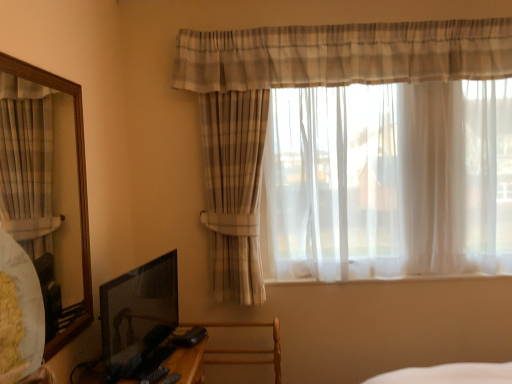
Locate an element on the screen. The image size is (512, 384). matte black tv at lower left is located at coordinates (136, 311).

The width and height of the screenshot is (512, 384). I want to click on swivel chair lying below the wooden mirror at left (from the image's perspective), so click(x=248, y=350).

Consider the image. Is wooden swivel chair at lower center to the right of wooden mirror at left from the viewer's perspective?

Yes.

Is wooden swivel chair at lower center wider or thinner than wooden mirror at left?

In the image, wooden swivel chair at lower center appears to be wider than wooden mirror at left.

Can you confirm if wooden mirror at left is positioned to the right of plaid sheer curtain at upper center?

Incorrect, wooden mirror at left is not on the right side of plaid sheer curtain at upper center.

Is wooden mirror at left spatially inside plaid sheer curtain at upper center, or outside of it?

wooden mirror at left cannot be found inside plaid sheer curtain at upper center.

In the scene shown: Is wooden mirror at left positioned before plaid sheer curtain at upper center?

Yes, it is in front of plaid sheer curtain at upper center.

Is wooden swivel chair at lower center positioned with its back to matte black tv at lower left?

No.

I want to click on picture frame above the wooden swivel chair at lower center (from a real-world perspective), so click(136, 311).

Which is in front, wooden swivel chair at lower center or matte black tv at lower left?

matte black tv at lower left is closer to the camera.

From a real-world perspective, is wooden swivel chair at lower center below matte black tv at lower left?

Indeed, from a real-world perspective, wooden swivel chair at lower center is positioned beneath matte black tv at lower left.

Looking at this image, considering the sizes of objects matte black tv at lower left and plaid sheer curtain at upper center in the image provided, who is bigger, matte black tv at lower left or plaid sheer curtain at upper center?

plaid sheer curtain at upper center is bigger.

Consider the image. Which point is more forward, (110, 301) or (231, 126)?

Positioned in front is point (110, 301).

Where is `curtain above the matte black tv at lower left (from the image's perspective)`? curtain above the matte black tv at lower left (from the image's perspective) is located at coordinates coord(330,66).

Could you tell me if plaid sheer curtain at upper center is facing wooden mirror at left?

Yes.

How many degrees apart are the facing directions of plaid sheer curtain at upper center and wooden mirror at left?

They differ by 89.8 degrees in their facing directions.

In the scene shown: Is plaid sheer curtain at upper center to the right of wooden mirror at left from the viewer's perspective?

Correct, you'll find plaid sheer curtain at upper center to the right of wooden mirror at left.

Would you say wooden mirror at left is part of plaid sheer curtain at upper center's contents?

No, wooden mirror at left is not surrounded by plaid sheer curtain at upper center.

Is matte black tv at lower left taller than wooden swivel chair at lower center?

Incorrect, the height of matte black tv at lower left is not larger of that of wooden swivel chair at lower center.

Considering their positions, is matte black tv at lower left located in front of or behind wooden swivel chair at lower center?

In the image, matte black tv at lower left appears in front of wooden swivel chair at lower center.

Based on their sizes in the image, would you say matte black tv at lower left is bigger or smaller than wooden swivel chair at lower center?

matte black tv at lower left is smaller than wooden swivel chair at lower center.

Is there a large distance between matte black tv at lower left and wooden swivel chair at lower center?

No.

Does matte black tv at lower left lie behind wooden mirror at left?

Yes, the depth of matte black tv at lower left is greater than that of wooden mirror at left.

Between point (173, 301) and point (58, 351), which one is positioned in front?

The point (58, 351) is in front.

Is matte black tv at lower left directly adjacent to wooden mirror at left?

No, matte black tv at lower left is not touching wooden mirror at left.

In the scene shown: Does matte black tv at lower left have a lesser width compared to wooden mirror at left?

In fact, matte black tv at lower left might be wider than wooden mirror at left.

Find the location of a particular element. swivel chair behind the wooden mirror at left is located at coordinates (248, 350).

Locate an element on the screen. The image size is (512, 384). curtain above the wooden mirror at left (from the image's perspective) is located at coordinates (330, 66).

Based on their spatial positions, is plaid sheer curtain at upper center or wooden mirror at left closer to matte black tv at lower left?

wooden mirror at left is closer to matte black tv at lower left.

Considering their positions, is matte black tv at lower left positioned closer to wooden swivel chair at lower center than plaid sheer curtain at upper center?

Among the two, matte black tv at lower left is located nearer to wooden swivel chair at lower center.

Based on their spatial positions, is wooden mirror at left or plaid sheer curtain at upper center further from matte black tv at lower left?

The object further to matte black tv at lower left is plaid sheer curtain at upper center.

From the image, which object appears to be nearer to wooden swivel chair at lower center, wooden mirror at left or plaid sheer curtain at upper center?

Among the two, plaid sheer curtain at upper center is located nearer to wooden swivel chair at lower center.

Considering their positions, is plaid sheer curtain at upper center positioned further to wooden swivel chair at lower center than matte black tv at lower left?

Among the two, plaid sheer curtain at upper center is located further to wooden swivel chair at lower center.

Which object lies nearer to the anchor point wooden mirror at left, plaid sheer curtain at upper center or wooden swivel chair at lower center?

Based on the image, wooden swivel chair at lower center appears to be nearer to wooden mirror at left.

Estimate the real-world distances between objects in this image. Which object is further from plaid sheer curtain at upper center, wooden mirror at left or wooden swivel chair at lower center?

Among the two, wooden mirror at left is located further to plaid sheer curtain at upper center.

From the image, which object appears to be nearer to matte black tv at lower left, wooden swivel chair at lower center or wooden mirror at left?

The object closer to matte black tv at lower left is wooden mirror at left.

At what (x,y) coordinates should I click in order to perform the action: click on picture frame located between wooden mirror at left and wooden swivel chair at lower center in the depth direction. Please return your answer as a coordinate pair (x, y). Looking at the image, I should click on (136, 311).

Locate an element on the screen. The height and width of the screenshot is (384, 512). picture frame that lies between plaid sheer curtain at upper center and wooden swivel chair at lower center from top to bottom is located at coordinates tap(136, 311).

This screenshot has width=512, height=384. Identify the location of swivel chair between wooden mirror at left and plaid sheer curtain at upper center from left to right. (248, 350).

Find the location of `picture frame situated between wooden mirror at left and plaid sheer curtain at upper center from left to right`. picture frame situated between wooden mirror at left and plaid sheer curtain at upper center from left to right is located at coordinates (136, 311).